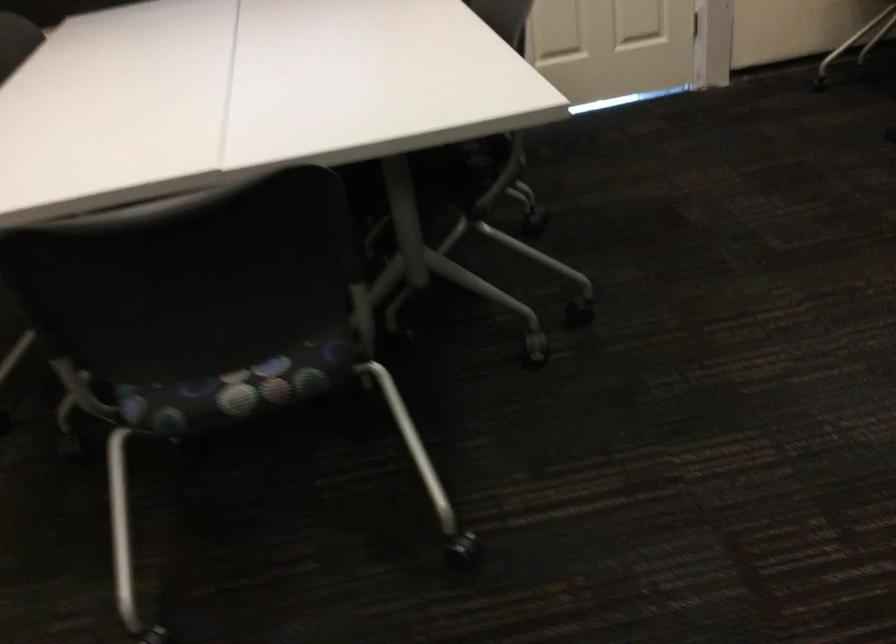
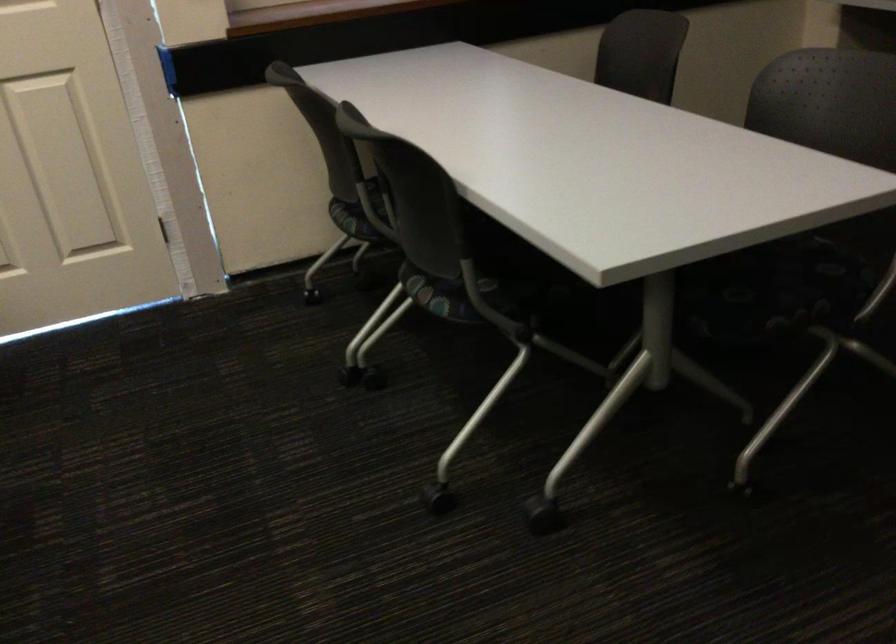
Question: In a continuous first-person perspective shot, in which direction is the camera moving?

Choices:
 (A) Left
 (B) Right
 (C) Forward
 (D) Backward

Answer: (B)